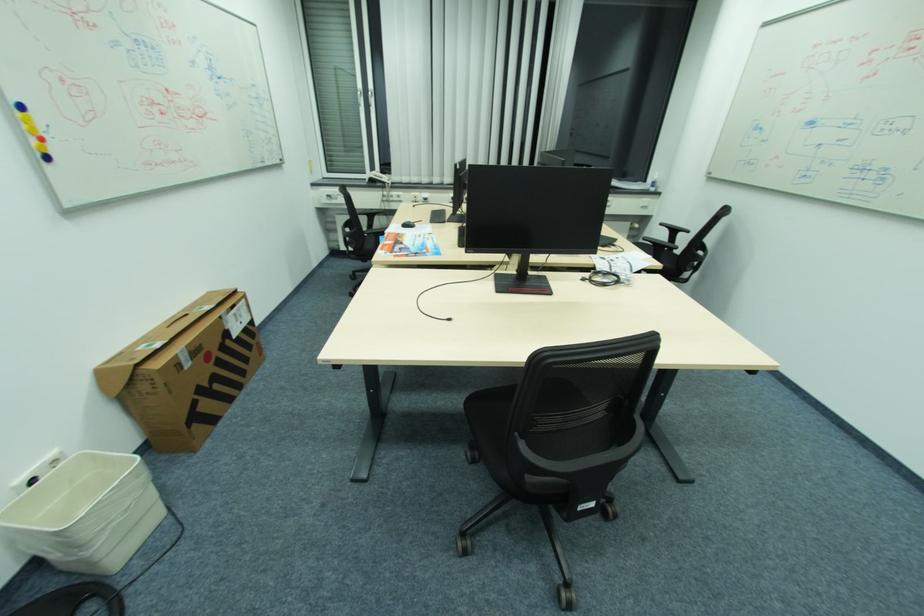
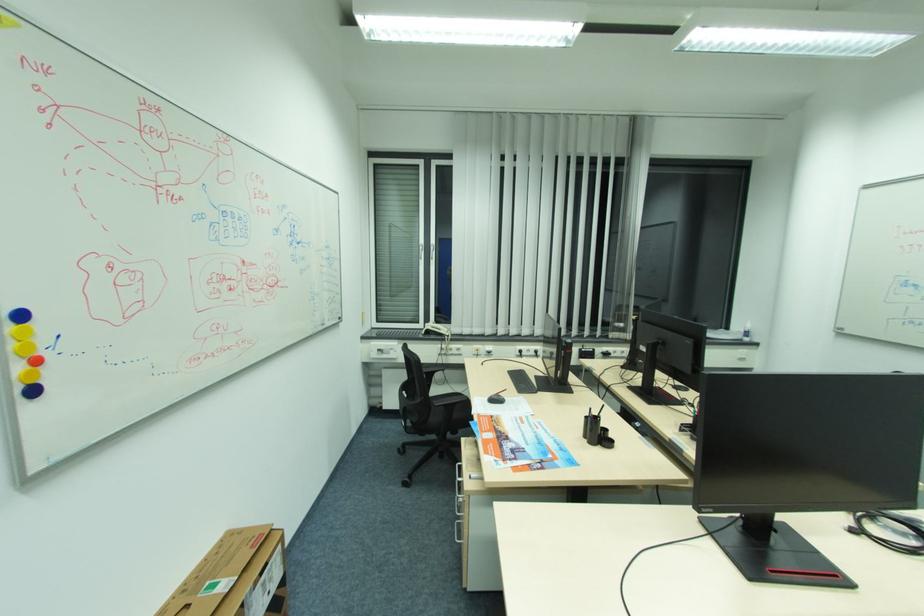
Which direction would the cameraman need to move to produce the second image?

The cameraman moved toward left, forward.